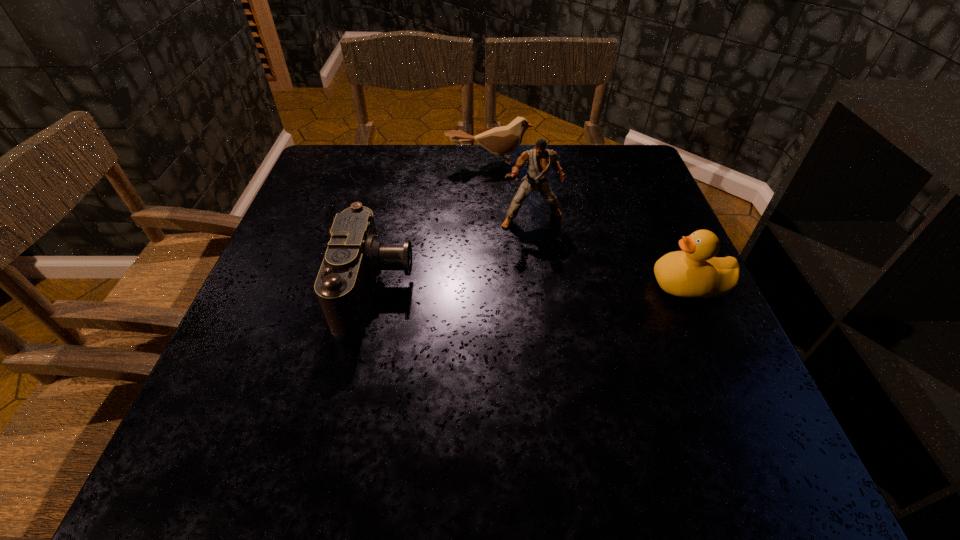
Identify the location of free space on the desktop that is between the leftmost object and the rightmost object and is positioned at the beak of the farthest object. (519, 286).

Locate an element on the screen. This screenshot has height=540, width=960. free space on the desktop that is between the camera and the duck and is positioned on the front-facing side of the puncher is located at coordinates (553, 286).